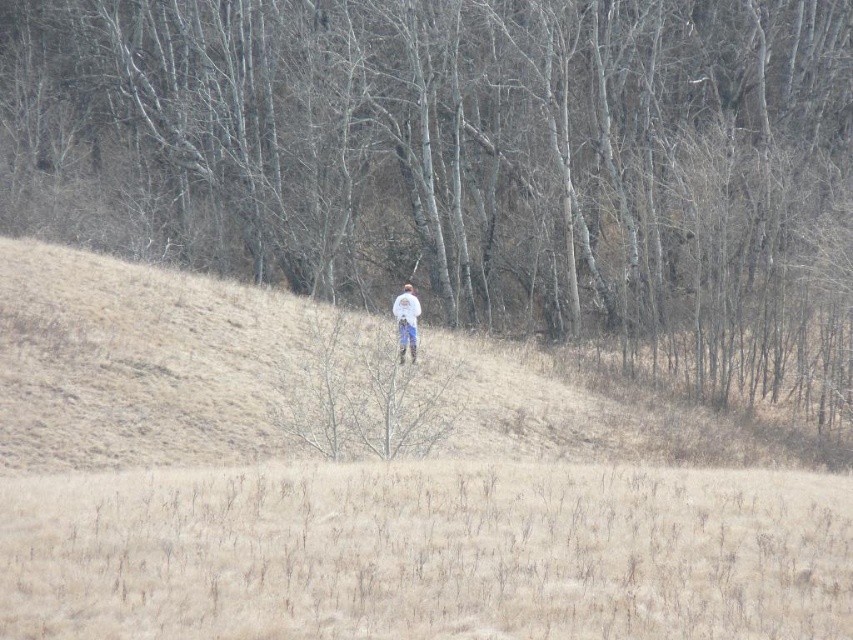
Question: Which point is farther to the camera?

Choices:
 (A) white cotton shirt at center
 (B) dry grass at center

Answer: (A)

Question: Which object is farther from the camera taking this photo?

Choices:
 (A) brown bark tree at center
 (B) dry grass at center
 (C) white cotton shirt at center

Answer: (A)

Question: Which point is farther from the camera taking this photo?

Choices:
 (A) (427, 538)
 (B) (630, 99)
 (C) (415, 296)

Answer: (B)

Question: Can you confirm if brown bark tree at center is positioned to the left of white cotton shirt at center?

Choices:
 (A) no
 (B) yes

Answer: (B)

Question: Is brown bark tree at center closer to the viewer compared to dry grass at center?

Choices:
 (A) no
 (B) yes

Answer: (A)

Question: Is the position of brown bark tree at center more distant than that of white cotton shirt at center?

Choices:
 (A) yes
 (B) no

Answer: (A)